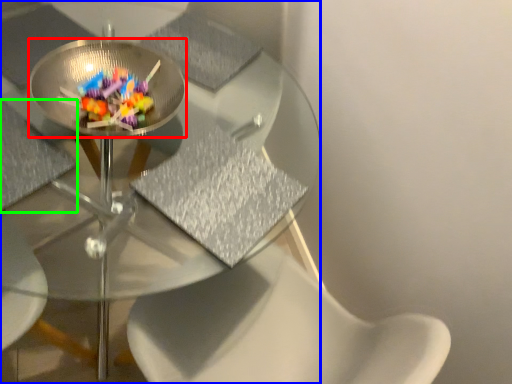
Question: Based on their relative distances, which object is farther from glass plate (highlighted by a red box)? Choose from table (highlighted by a blue box) and chair (highlighted by a green box).

Choices:
 (A) table
 (B) chair

Answer: (A)